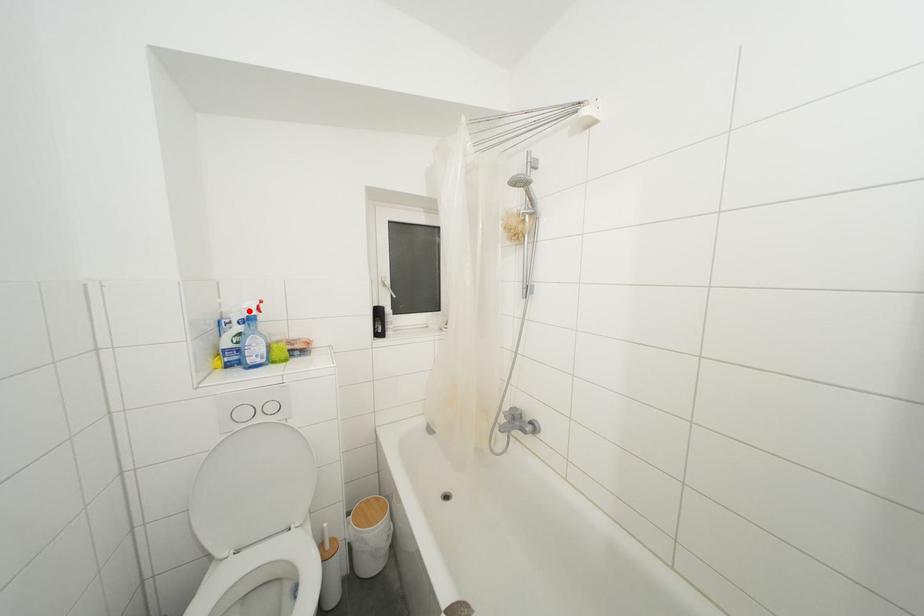
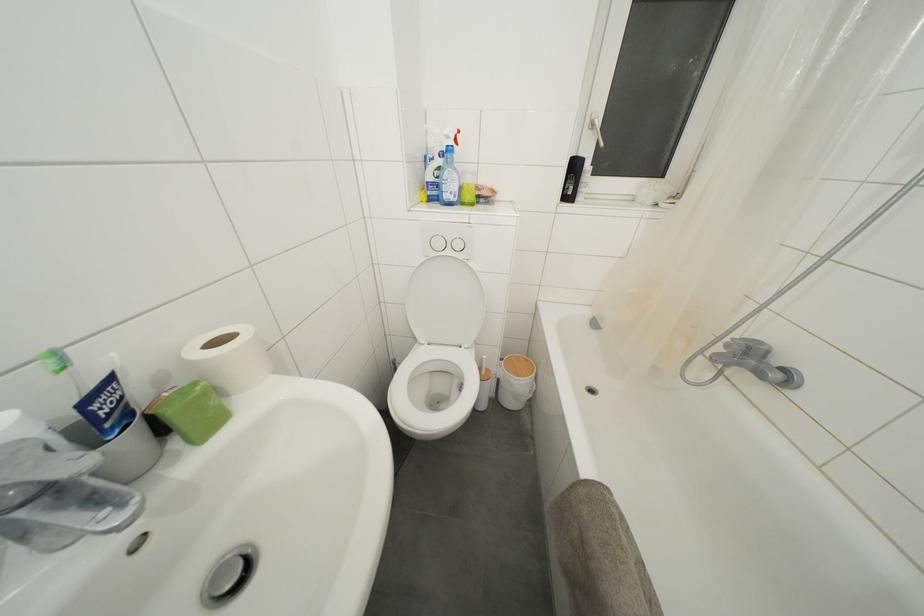
The point at the highlighted location is marked in the first image. Where is the corresponding point in the second image?

(450, 138)